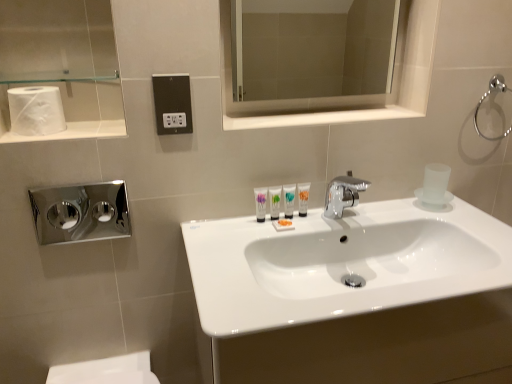
Where is `vacant space that is to the left of translucent plastic mouthwash at center, the first mouthwash from the right`? The height and width of the screenshot is (384, 512). vacant space that is to the left of translucent plastic mouthwash at center, the first mouthwash from the right is located at coordinates (243, 229).